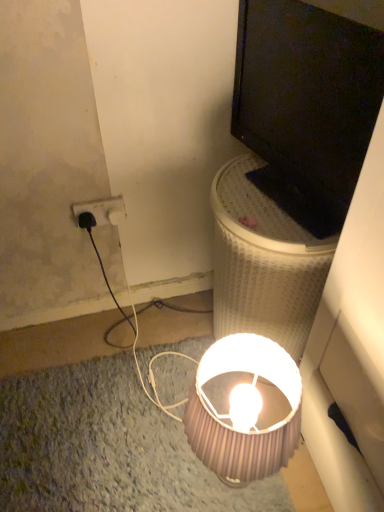
Question: From a real-world perspective, is black glossy monitor at upper right under pink ribbed lampshade at lower center?

Choices:
 (A) yes
 (B) no

Answer: (B)

Question: From a real-world perspective, is black glossy monitor at upper right located higher than pink ribbed lampshade at lower center?

Choices:
 (A) yes
 (B) no

Answer: (A)

Question: Is black glossy monitor at upper right further to the viewer compared to pink ribbed lampshade at lower center?

Choices:
 (A) no
 (B) yes

Answer: (A)

Question: Is black glossy monitor at upper right facing away from pink ribbed lampshade at lower center?

Choices:
 (A) no
 (B) yes

Answer: (A)

Question: From the image's perspective, is black glossy monitor at upper right on pink ribbed lampshade at lower center?

Choices:
 (A) yes
 (B) no

Answer: (A)

Question: Is black glossy monitor at upper right next to pink ribbed lampshade at lower center and touching it?

Choices:
 (A) yes
 (B) no

Answer: (B)

Question: Is pink ribbed lampshade at lower center not inside black glossy monitor at upper right?

Choices:
 (A) no
 (B) yes

Answer: (B)

Question: Is pink ribbed lampshade at lower center to the left of black glossy monitor at upper right from the viewer's perspective?

Choices:
 (A) yes
 (B) no

Answer: (A)

Question: Does pink ribbed lampshade at lower center turn towards black glossy monitor at upper right?

Choices:
 (A) yes
 (B) no

Answer: (B)

Question: Does pink ribbed lampshade at lower center have a smaller size compared to black glossy monitor at upper right?

Choices:
 (A) no
 (B) yes

Answer: (A)

Question: Is pink ribbed lampshade at lower center to the right of black glossy monitor at upper right from the viewer's perspective?

Choices:
 (A) yes
 (B) no

Answer: (B)

Question: Can you confirm if pink ribbed lampshade at lower center is bigger than black glossy monitor at upper right?

Choices:
 (A) yes
 (B) no

Answer: (A)

Question: Considering the relative sizes of pink ribbed lampshade at lower center and white mesh laundry basket at upper right in the image provided, is pink ribbed lampshade at lower center taller than white mesh laundry basket at upper right?

Choices:
 (A) no
 (B) yes

Answer: (A)